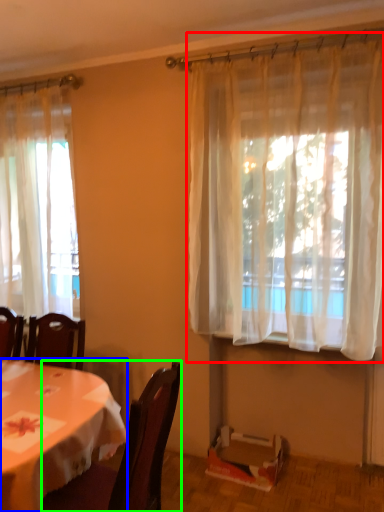
Question: Estimate the real-world distances between objects in this image. Which object is closer to curtain (highlighted by a red box), desk (highlighted by a blue box) or chair (highlighted by a green box)?

Choices:
 (A) desk
 (B) chair

Answer: (B)